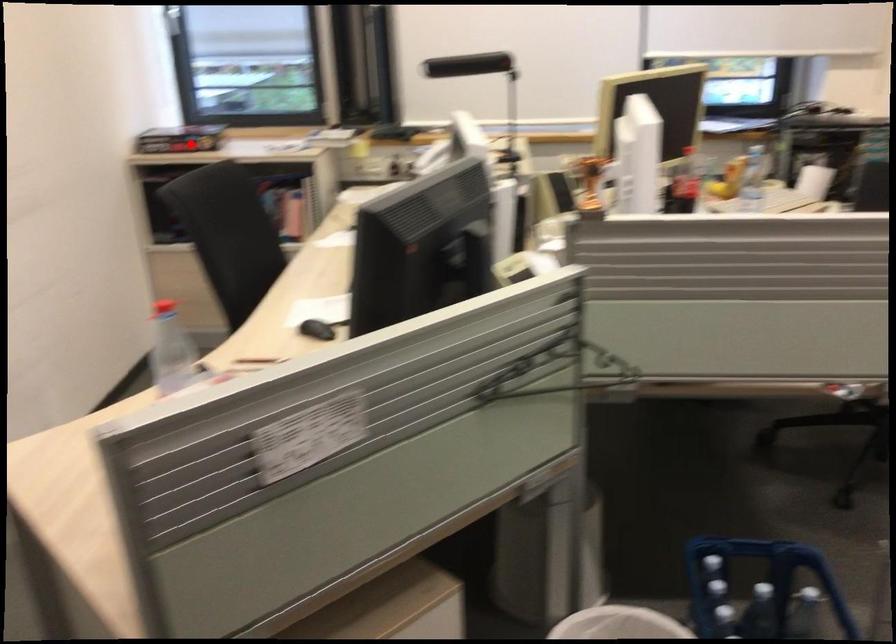
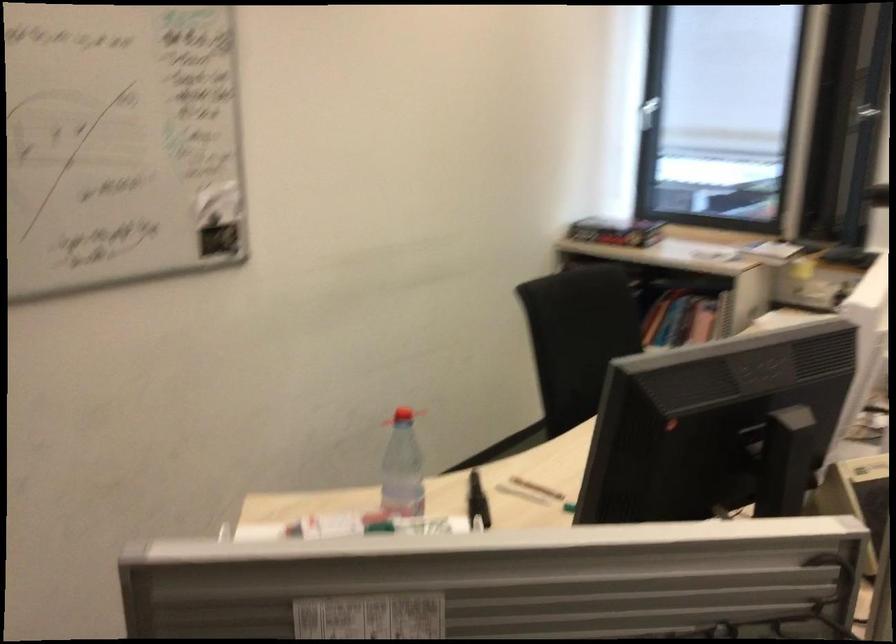
Where in the second image is the point corresponding to the highlighted location from the first image?

(615, 232)